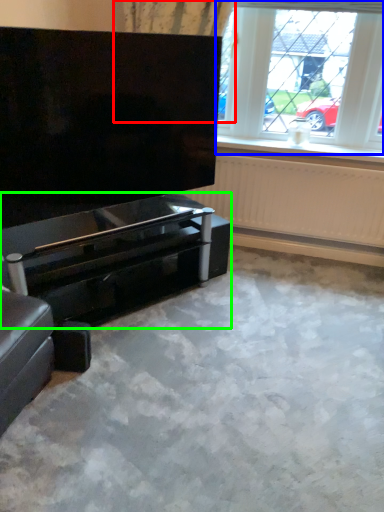
Question: Considering the real-world distances, which object is closest to curtain (highlighted by a red box)? window (highlighted by a blue box) or piano (highlighted by a green box).

Choices:
 (A) window
 (B) piano

Answer: (A)